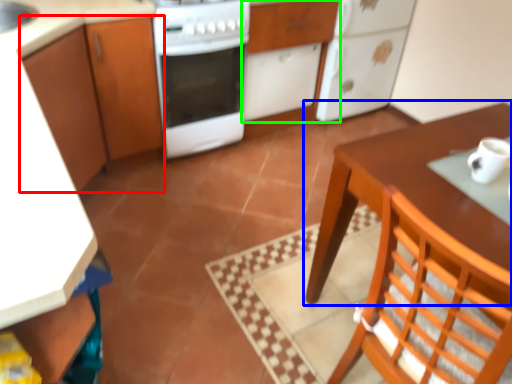
Question: Estimate the real-world distances between objects in this image. Which object is closer to cabinetry (highlighted by a red box), table (highlighted by a blue box) or cabinetry (highlighted by a green box)?

Choices:
 (A) table
 (B) cabinetry

Answer: (B)